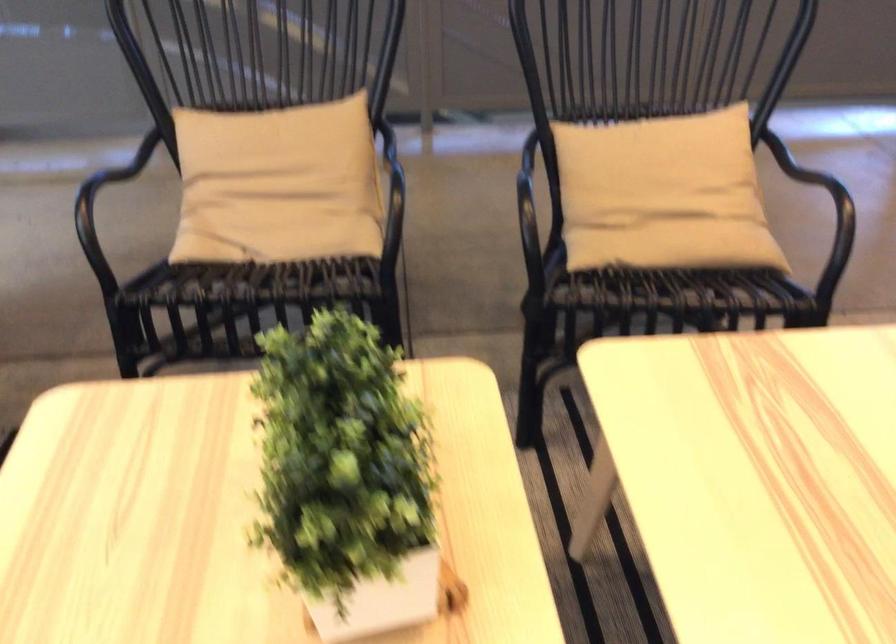
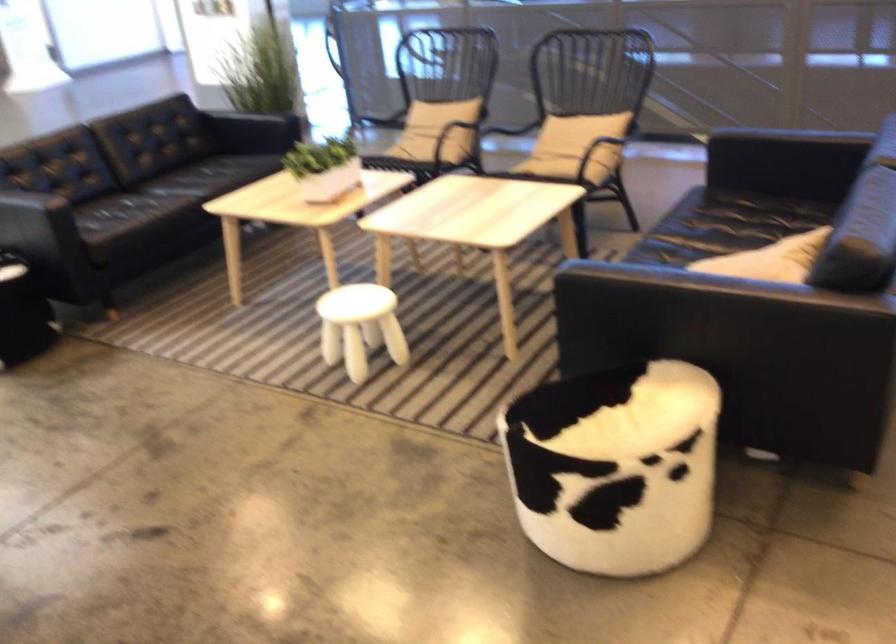
Find the pixel in the second image that matches point 703,247 in the first image.

(552, 160)